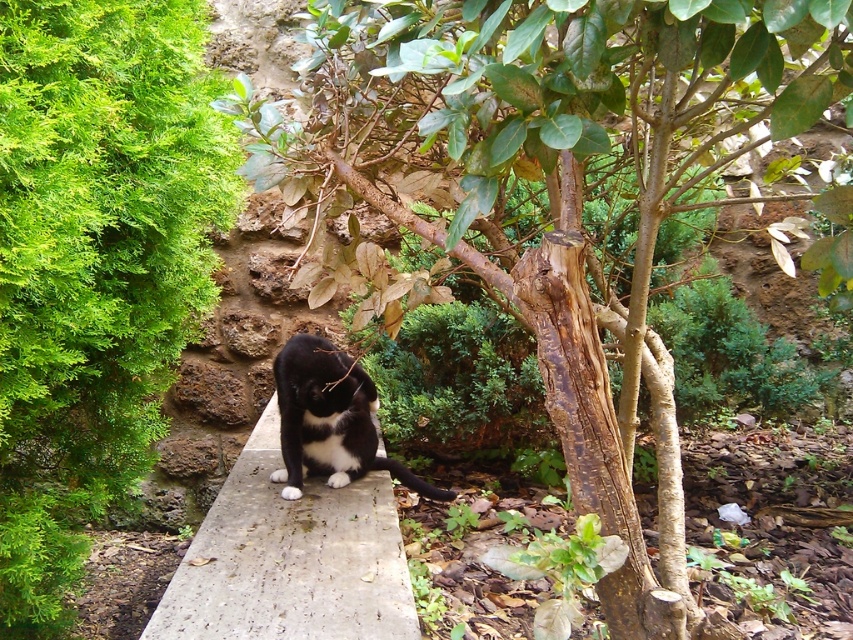
You are a photographer trying to capture the black fur cat at center sitting on the concrete at center. If you want to ensure the cat is fully visible in the photo, which object should you focus on first?

The concrete at center is larger in size than the black fur cat at center, so you should focus on the black fur cat at center first to ensure it is fully visible.

In the scene shown: You are a painter standing on the concrete at center. You want to paint the green leafy bush at left. Can you see the entire bush from your current position?

The green leafy bush at left is above concrete at center, so yes, you can see the entire bush from your current position because it is positioned higher than the concrete.

You are a bird flying over the scene and want to land on the highest point between the green leafy bush at left and the black fur cat at center. Which one should you choose?

The green leafy bush at left is much taller than the black fur cat at center, so you should choose the green leafy bush at left to land on the highest point.